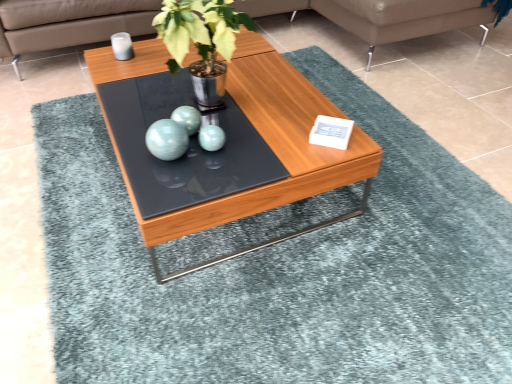
Question: Is the position of leather couch at upper right more distant than that of teal glossy sphere at center?

Choices:
 (A) no
 (B) yes

Answer: (B)

Question: Considering the relative sizes of leather couch at upper right and teal glossy sphere at center in the image provided, is leather couch at upper right smaller than teal glossy sphere at center?

Choices:
 (A) no
 (B) yes

Answer: (A)

Question: Considering the relative sizes of leather couch at upper right and teal glossy sphere at center in the image provided, is leather couch at upper right bigger than teal glossy sphere at center?

Choices:
 (A) no
 (B) yes

Answer: (B)

Question: Would you say leather couch at upper right contains teal glossy sphere at center?

Choices:
 (A) no
 (B) yes

Answer: (A)

Question: Is leather couch at upper right completely or partially outside of teal glossy sphere at center?

Choices:
 (A) no
 (B) yes

Answer: (B)

Question: Considering the relative positions of leather couch at upper right and teal glossy sphere at center in the image provided, is leather couch at upper right to the left of teal glossy sphere at center from the viewer's perspective?

Choices:
 (A) yes
 (B) no

Answer: (B)

Question: Does teal glossy sphere at center have a greater height compared to leather couch at upper center?

Choices:
 (A) yes
 (B) no

Answer: (B)

Question: Is teal glossy sphere at center to the left of leather couch at upper center from the viewer's perspective?

Choices:
 (A) yes
 (B) no

Answer: (B)

Question: From a real-world perspective, does teal glossy sphere at center sit lower than leather couch at upper center?

Choices:
 (A) yes
 (B) no

Answer: (B)

Question: Could you tell me if teal glossy sphere at center is facing leather couch at upper center?

Choices:
 (A) no
 (B) yes

Answer: (A)

Question: Does teal glossy sphere at center have a lesser width compared to leather couch at upper center?

Choices:
 (A) no
 (B) yes

Answer: (B)

Question: Can you confirm if teal glossy sphere at center is smaller than leather couch at upper center?

Choices:
 (A) yes
 (B) no

Answer: (A)

Question: From the image's perspective, is metallic green plant at center located beneath leather couch at upper center?

Choices:
 (A) yes
 (B) no

Answer: (A)